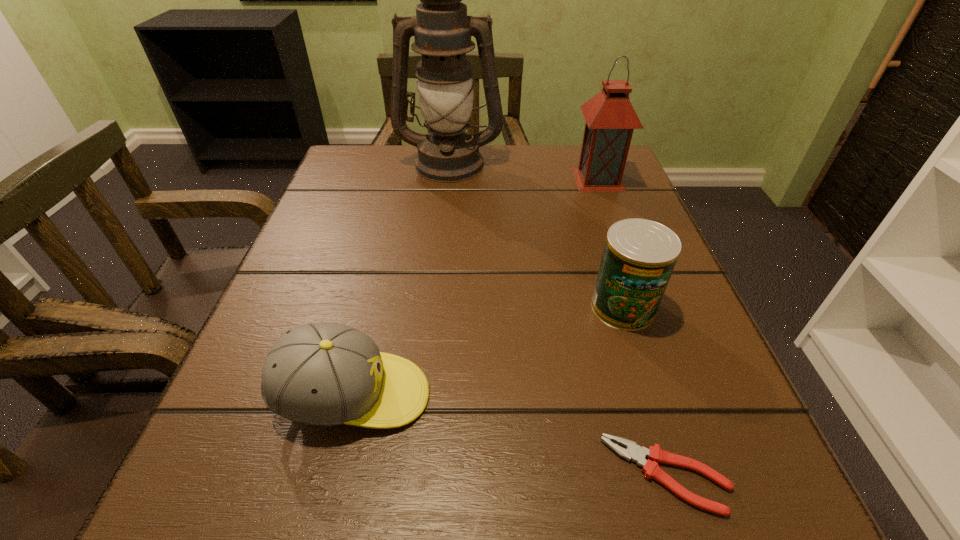
The width and height of the screenshot is (960, 540). Find the location of `blank area in the image that satisfies the following two spatial constraints: 1. on the front side of the lantern; 2. on the front-facing side of the second shortest object`. blank area in the image that satisfies the following two spatial constraints: 1. on the front side of the lantern; 2. on the front-facing side of the second shortest object is located at coordinates (680, 396).